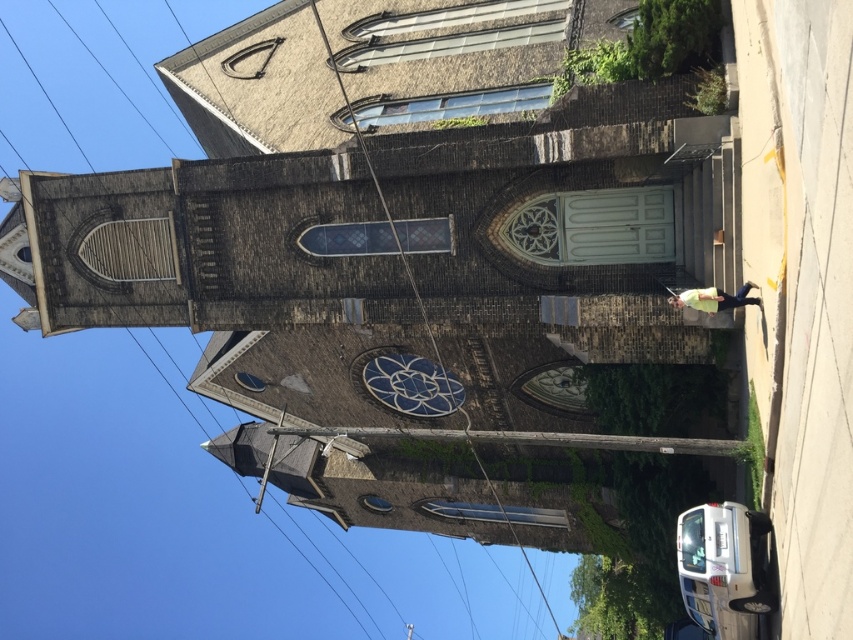
You are standing in front of the church and notice the blue stained glass clock at center and the metallic wire at center. Which object is located higher up on the building?

The blue stained glass clock at center is positioned over the metallic wire at center, so it is located higher up on the building.

Based on the scene described, what color is the stained glass clock located at point (408,384)?

The stained glass clock at point (408,384) is blue.

You are standing in front of the historic church and want to take a photo of the blue stained glass clock at center. If your camera has a maximum focus range of 80 meters, will you be able to capture a clear photo from your current position?

The blue stained glass clock at center and camera are 86.61 meters apart from each other. Since the distance exceeds the camera maximum focus range of 80 meters, you won not be able to capture a clear photo from your current position.